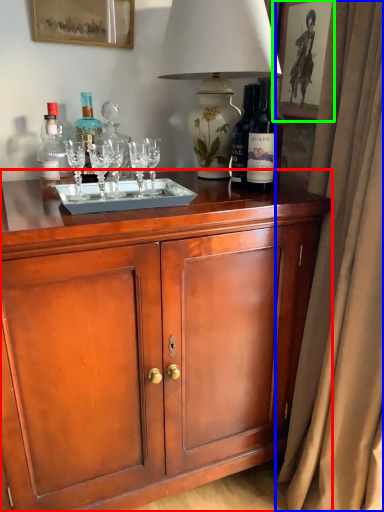
Question: Based on their relative distances, which object is nearer to cabinetry (highlighted by a red box)? Choose from curtain (highlighted by a blue box) and picture frame (highlighted by a green box).

Choices:
 (A) curtain
 (B) picture frame

Answer: (A)